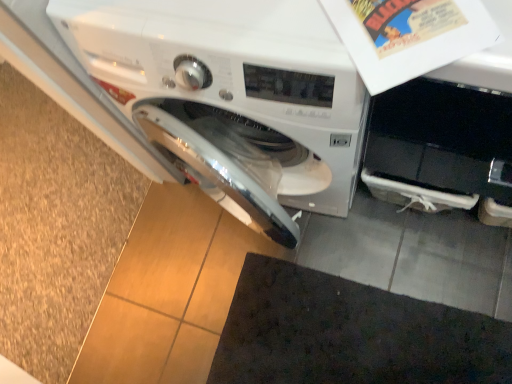
Question: Looking at their shapes, would you say white glossy washing machine at center is wider or thinner than dark fabric doormat at lower center?

Choices:
 (A) wide
 (B) thin

Answer: (B)

Question: Is white glossy washing machine at center inside the boundaries of dark fabric doormat at lower center, or outside?

Choices:
 (A) inside
 (B) outside

Answer: (B)

Question: From a real-world perspective, is white glossy washing machine at center physically located above or below dark fabric doormat at lower center?

Choices:
 (A) below
 (B) above

Answer: (B)

Question: From a real-world perspective, relative to white glossy washing machine at center, is dark fabric doormat at lower center vertically above or below?

Choices:
 (A) above
 (B) below

Answer: (B)

Question: Based on their sizes in the image, would you say dark fabric doormat at lower center is bigger or smaller than white glossy washing machine at center?

Choices:
 (A) big
 (B) small

Answer: (B)

Question: From the image's perspective, is dark fabric doormat at lower center located above or below white glossy washing machine at center?

Choices:
 (A) below
 (B) above

Answer: (A)

Question: Would you say dark fabric doormat at lower center is to the left or to the right of white glossy washing machine at center in the picture?

Choices:
 (A) left
 (B) right

Answer: (B)